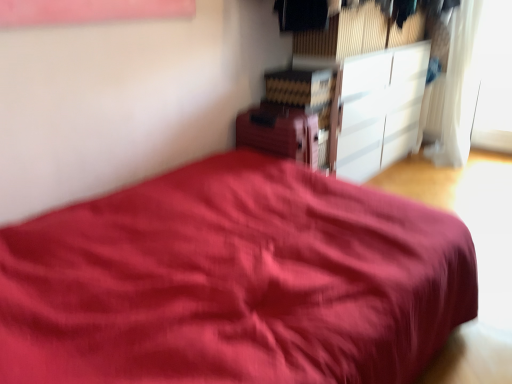
This screenshot has width=512, height=384. What do you see at coordinates (378, 109) in the screenshot?
I see `white glossy cabinet at upper right, which ranks as the 2th cabinetry in front-to-back order` at bounding box center [378, 109].

This screenshot has width=512, height=384. Identify the location of matte wooden cabinet at upper center, arranged as the 2th cabinetry when viewed from the back. (279, 132).

Is matte wooden cabinet at upper center, arranged as the 2th cabinetry when viewed from the back, far away from white sheer curtain at upper right?

Yes, matte wooden cabinet at upper center, arranged as the 2th cabinetry when viewed from the back, and white sheer curtain at upper right are quite far apart.

Consider the image. Considering the positions of objects matte wooden cabinet at upper center, placed as the 2th cabinetry when sorted from right to left, and white sheer curtain at upper right in the image provided, who is more to the left, matte wooden cabinet at upper center, placed as the 2th cabinetry when sorted from right to left, or white sheer curtain at upper right?

matte wooden cabinet at upper center, placed as the 2th cabinetry when sorted from right to left.

From the image's perspective, which one is positioned higher, matte wooden cabinet at upper center, arranged as the 2th cabinetry when viewed from the back, or white sheer curtain at upper right?

From the image's view, white sheer curtain at upper right is above.

Considering the positions of objects matte wooden cabinet at upper center, positioned as the first cabinetry in front-to-back order, and white sheer curtain at upper right in the image provided, who is behind, matte wooden cabinet at upper center, positioned as the first cabinetry in front-to-back order, or white sheer curtain at upper right?

white sheer curtain at upper right is further from the camera.

In the image, there is a white glossy cabinet at upper right, which ranks as the 2th cabinetry in front-to-back order. Identify the location of window above it (from the image's perspective). This screenshot has width=512, height=384. (495, 80).

In terms of size, does transparent glass window at upper right appear bigger or smaller than white glossy cabinet at upper right, which ranks as the 2th cabinetry in front-to-back order?

Result: Clearly, transparent glass window at upper right is smaller in size than white glossy cabinet at upper right, which ranks as the 2th cabinetry in front-to-back order.

Is transparent glass window at upper right facing away from white glossy cabinet at upper right, the 2th cabinetry in the left-to-right sequence?

No, transparent glass window at upper right is not facing away from white glossy cabinet at upper right, the 2th cabinetry in the left-to-right sequence.

Is transparent glass window at upper right wider than white glossy cabinet at upper right, the 2th cabinetry in the left-to-right sequence?

No.

From the picture: From the image's perspective, is white sheer curtain at upper right positioned above or below transparent glass window at upper right?

Clearly, from the image's perspective, white sheer curtain at upper right is below transparent glass window at upper right.

Is white sheer curtain at upper right facing away from transparent glass window at upper right?

No, white sheer curtain at upper right is not facing the opposite direction of transparent glass window at upper right.

Which object is positioned more to the right, white sheer curtain at upper right or transparent glass window at upper right?

transparent glass window at upper right.

How distant is white sheer curtain at upper right from transparent glass window at upper right?

white sheer curtain at upper right and transparent glass window at upper right are 29.33 centimeters apart from each other.

Considering the sizes of objects white sheer curtain at upper right and matte wooden cabinet at upper center, the first cabinetry positioned from the left, in the image provided, who is taller, white sheer curtain at upper right or matte wooden cabinet at upper center, the first cabinetry positioned from the left,?

white sheer curtain at upper right.

From a real-world perspective, which is physically above, white sheer curtain at upper right or matte wooden cabinet at upper center, positioned as the first cabinetry in front-to-back order?

In real-world perspective, white sheer curtain at upper right is above.

Who is bigger, white sheer curtain at upper right or matte wooden cabinet at upper center, placed as the 2th cabinetry when sorted from right to left?

white sheer curtain at upper right is bigger.

Are white sheer curtain at upper right and matte wooden cabinet at upper center, arranged as the 2th cabinetry when viewed from the back, located far from each other?

Yes, white sheer curtain at upper right and matte wooden cabinet at upper center, arranged as the 2th cabinetry when viewed from the back, are located far from each other.

Which is more to the right, transparent glass window at upper right or white sheer curtain at upper right?

transparent glass window at upper right is more to the right.

Is transparent glass window at upper right facing towards white sheer curtain at upper right?

No.

Who is smaller, transparent glass window at upper right or white sheer curtain at upper right?

transparent glass window at upper right is smaller.

Can you tell me how much transparent glass window at upper right and white sheer curtain at upper right differ in facing direction?

They differ by 0.478 degrees in their facing directions.

Considering the sizes of matte wooden cabinet at upper center, placed as the 2th cabinetry when sorted from right to left, and white glossy cabinet at upper right, placed as the 1th cabinetry when sorted from right to left, in the image, is matte wooden cabinet at upper center, placed as the 2th cabinetry when sorted from right to left, taller or shorter than white glossy cabinet at upper right, placed as the 1th cabinetry when sorted from right to left,?

matte wooden cabinet at upper center, placed as the 2th cabinetry when sorted from right to left, is shorter than white glossy cabinet at upper right, placed as the 1th cabinetry when sorted from right to left.

Is matte wooden cabinet at upper center, positioned as the first cabinetry in front-to-back order, turned away from white glossy cabinet at upper right, the 2th cabinetry in the left-to-right sequence?

No, matte wooden cabinet at upper center, positioned as the first cabinetry in front-to-back order, is not facing the opposite direction of white glossy cabinet at upper right, the 2th cabinetry in the left-to-right sequence.

Considering the sizes of objects matte wooden cabinet at upper center, the first cabinetry positioned from the left, and white glossy cabinet at upper right, the 2th cabinetry in the left-to-right sequence, in the image provided, who is wider, matte wooden cabinet at upper center, the first cabinetry positioned from the left, or white glossy cabinet at upper right, the 2th cabinetry in the left-to-right sequence,?

matte wooden cabinet at upper center, the first cabinetry positioned from the left.

Considering the relative sizes of transparent glass window at upper right and matte wooden cabinet at upper center, the first cabinetry positioned from the left, in the image provided, is transparent glass window at upper right taller than matte wooden cabinet at upper center, the first cabinetry positioned from the left,?

Yes.

Locate an element on the screen. This screenshot has height=384, width=512. the 2nd cabinetry below the transparent glass window at upper right (from the image's perspective) is located at coordinates (279, 132).

Can you confirm if transparent glass window at upper right is bigger than matte wooden cabinet at upper center, arranged as the 2th cabinetry when viewed from the back?

No, transparent glass window at upper right is not bigger than matte wooden cabinet at upper center, arranged as the 2th cabinetry when viewed from the back.

Are transparent glass window at upper right and matte wooden cabinet at upper center, arranged as the 2th cabinetry when viewed from the back, far apart?

Indeed, transparent glass window at upper right is not near matte wooden cabinet at upper center, arranged as the 2th cabinetry when viewed from the back.

The image size is (512, 384). I want to click on curtain above the matte wooden cabinet at upper center, arranged as the 2th cabinetry when viewed from the back (from a real-world perspective), so click(x=459, y=87).

This screenshot has height=384, width=512. Find the location of `cabinetry that is the 1st one when counting leftward from the transparent glass window at upper right`. cabinetry that is the 1st one when counting leftward from the transparent glass window at upper right is located at coordinates (378, 109).

Looking at the image, which one is located closer to transparent glass window at upper right, matte wooden cabinet at upper center, the first cabinetry positioned from the left, or white glossy cabinet at upper right, which is the first cabinetry from back to front?

white glossy cabinet at upper right, which is the first cabinetry from back to front, is positioned closer to the anchor transparent glass window at upper right.

Looking at the image, which one is located further to white sheer curtain at upper right, white glossy cabinet at upper right, placed as the 1th cabinetry when sorted from right to left, or matte wooden cabinet at upper center, the first cabinetry positioned from the left?

matte wooden cabinet at upper center, the first cabinetry positioned from the left, is positioned further to the anchor white sheer curtain at upper right.

Based on their spatial positions, is white sheer curtain at upper right or transparent glass window at upper right further from white glossy cabinet at upper right, placed as the 1th cabinetry when sorted from right to left?

Based on the image, transparent glass window at upper right appears to be further to white glossy cabinet at upper right, placed as the 1th cabinetry when sorted from right to left.

Looking at the image, which one is located closer to transparent glass window at upper right, white sheer curtain at upper right or matte wooden cabinet at upper center, positioned as the first cabinetry in front-to-back order?

The object closer to transparent glass window at upper right is white sheer curtain at upper right.

When comparing their distances from transparent glass window at upper right, does matte wooden cabinet at upper center, positioned as the first cabinetry in front-to-back order, or white sheer curtain at upper right seem closer?

The object closer to transparent glass window at upper right is white sheer curtain at upper right.

Based on their spatial positions, is matte wooden cabinet at upper center, arranged as the 2th cabinetry when viewed from the back, or transparent glass window at upper right closer to white sheer curtain at upper right?

The object closer to white sheer curtain at upper right is transparent glass window at upper right.

Estimate the real-world distances between objects in this image. Which object is closer to matte wooden cabinet at upper center, arranged as the 2th cabinetry when viewed from the back, white glossy cabinet at upper right, the 2th cabinetry in the left-to-right sequence, or white sheer curtain at upper right?

white glossy cabinet at upper right, the 2th cabinetry in the left-to-right sequence, is closer to matte wooden cabinet at upper center, arranged as the 2th cabinetry when viewed from the back.

Looking at the image, which one is located closer to white sheer curtain at upper right, white glossy cabinet at upper right, which is the first cabinetry from back to front, or transparent glass window at upper right?

transparent glass window at upper right lies closer to white sheer curtain at upper right than the other object.

Image resolution: width=512 pixels, height=384 pixels. I want to click on cabinetry between matte wooden cabinet at upper center, the first cabinetry positioned from the left, and transparent glass window at upper right from left to right, so click(378, 109).

Locate an element on the screen. curtain between white glossy cabinet at upper right, which is the first cabinetry from back to front, and transparent glass window at upper right is located at coordinates (459, 87).

In order to click on curtain between matte wooden cabinet at upper center, the first cabinetry positioned from the left, and transparent glass window at upper right, in the horizontal direction in this screenshot , I will do `click(459, 87)`.

You are a GUI agent. You are given a task and a screenshot of the screen. Output one action in this format:
    pyautogui.click(x=<x>, y=<y>)
    Task: Click on the cabinetry situated between matte wooden cabinet at upper center, arranged as the 2th cabinetry when viewed from the back, and white sheer curtain at upper right from left to right
    
    Given the screenshot: What is the action you would take?
    pyautogui.click(x=378, y=109)